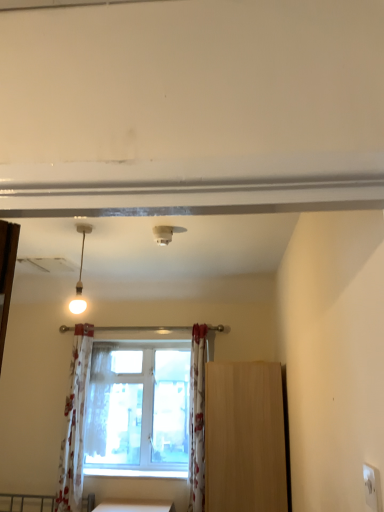
Question: Is white floral fabric at center spatially inside white plastic electric outlet at lower right, or outside of it?

Choices:
 (A) outside
 (B) inside

Answer: (A)

Question: Is white floral fabric at center wider or thinner than white plastic electric outlet at lower right?

Choices:
 (A) wide
 (B) thin

Answer: (A)

Question: Which is nearer to the light brown wood cabinet at right?

Choices:
 (A) clear glass window at center
 (B) white plastic electric outlet at lower right
 (C) matte white pendant light at upper left
 (D) white floral fabric curtain at left, the second curtain when ordered from right to left
 (E) white plastic smoke detector at upper center

Answer: (A)

Question: Which of these objects is positioned farthest from the white plastic smoke detector at upper center?

Choices:
 (A) white floral fabric curtain at left, the second curtain when ordered from right to left
 (B) clear glass window at center
 (C) white floral fabric at center
 (D) white floral fabric curtain at center, acting as the first curtain starting from the right
 (E) light brown wood cabinet at right

Answer: (C)